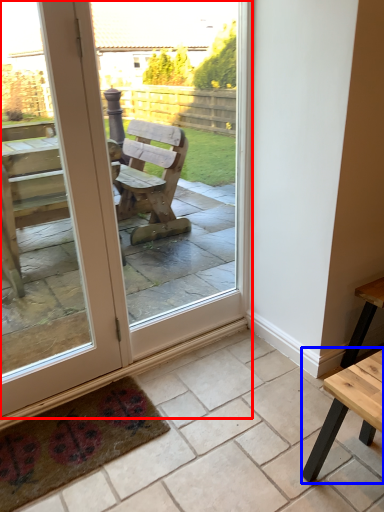
Question: Which object appears closest to the camera in this image, door (highlighted by a red box) or table (highlighted by a blue box)?

Choices:
 (A) door
 (B) table

Answer: (B)